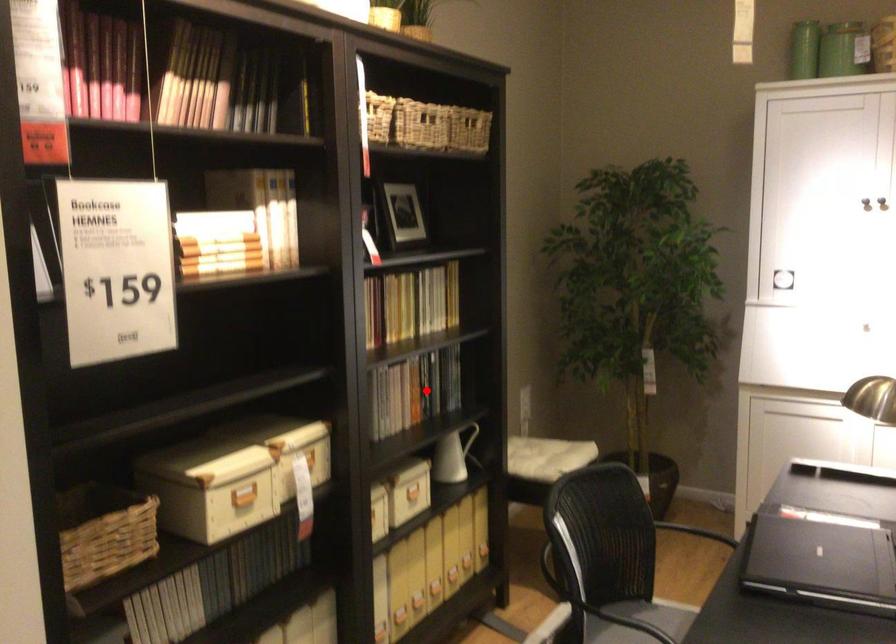
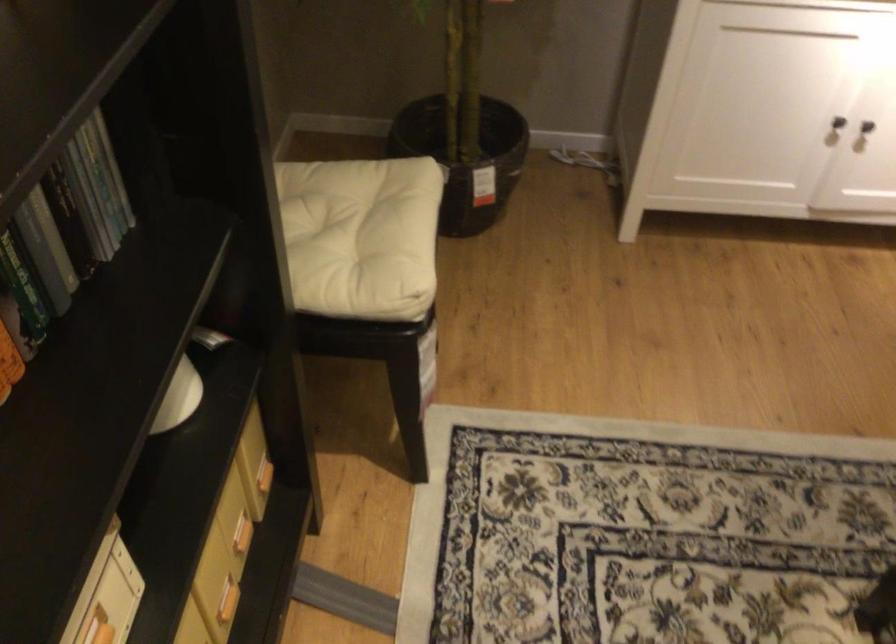
Locate, in the second image, the point that corresponds to the highlighted location in the first image.

(30, 240)